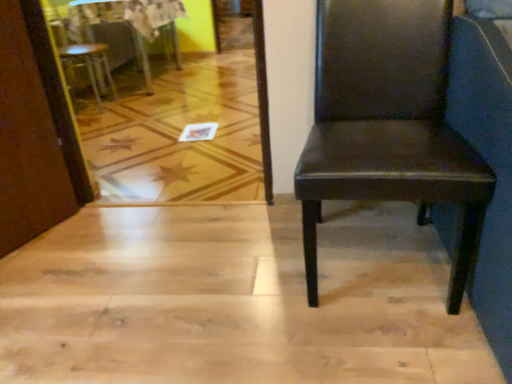
Question: Is matte brown chair at upper left, arranged as the second chair when viewed from the front, located outside matte brown leather chair at right, which ranks as the 2th chair in back-to-front order?

Choices:
 (A) yes
 (B) no

Answer: (A)

Question: Is matte brown chair at upper left, placed as the 2th chair when sorted from right to left, closer to the viewer compared to matte brown leather chair at right, placed as the 1th chair when sorted from bottom to top?

Choices:
 (A) yes
 (B) no

Answer: (B)

Question: Could you tell me if matte brown chair at upper left, positioned as the second chair in bottom-to-top order, is facing matte brown leather chair at right, which ranks as the 2th chair in back-to-front order?

Choices:
 (A) no
 (B) yes

Answer: (A)

Question: Is matte brown chair at upper left, the 1th chair viewed from the left, further to camera compared to matte brown leather chair at right, placed as the 1th chair when sorted from bottom to top?

Choices:
 (A) no
 (B) yes

Answer: (B)

Question: Considering the relative sizes of matte brown chair at upper left, which appears as the 1th chair when viewed from the back, and matte brown leather chair at right, acting as the 1th chair starting from the right, in the image provided, is matte brown chair at upper left, which appears as the 1th chair when viewed from the back, wider than matte brown leather chair at right, acting as the 1th chair starting from the right,?

Choices:
 (A) no
 (B) yes

Answer: (A)

Question: Can you confirm if matte brown chair at upper left, which appears as the 1th chair when viewed from the back, is smaller than matte brown leather chair at right, placed as the 1th chair when sorted from bottom to top?

Choices:
 (A) yes
 (B) no

Answer: (A)

Question: Is wooden table at upper left shorter than matte brown leather chair at right, acting as the 1th chair starting from the right?

Choices:
 (A) yes
 (B) no

Answer: (A)

Question: Are wooden table at upper left and matte brown leather chair at right, which ranks as the 2th chair in back-to-front order, beside each other?

Choices:
 (A) no
 (B) yes

Answer: (A)

Question: Is wooden table at upper left completely or partially outside of matte brown leather chair at right, acting as the 1th chair starting from the right?

Choices:
 (A) yes
 (B) no

Answer: (A)

Question: Considering the relative sizes of wooden table at upper left and matte brown leather chair at right, which appears as the 1th chair when viewed from the front, in the image provided, is wooden table at upper left bigger than matte brown leather chair at right, which appears as the 1th chair when viewed from the front,?

Choices:
 (A) no
 (B) yes

Answer: (B)

Question: Does wooden table at upper left appear on the left side of matte brown leather chair at right, placed as the 2th chair when sorted from top to bottom?

Choices:
 (A) no
 (B) yes

Answer: (B)

Question: Could you tell me if wooden table at upper left is turned towards matte brown leather chair at right, acting as the 1th chair starting from the right?

Choices:
 (A) yes
 (B) no

Answer: (B)

Question: Can you confirm if matte brown leather chair at right, the 2th chair from the left, is positioned to the left of matte brown chair at upper left, arranged as the second chair when viewed from the front?

Choices:
 (A) yes
 (B) no

Answer: (B)